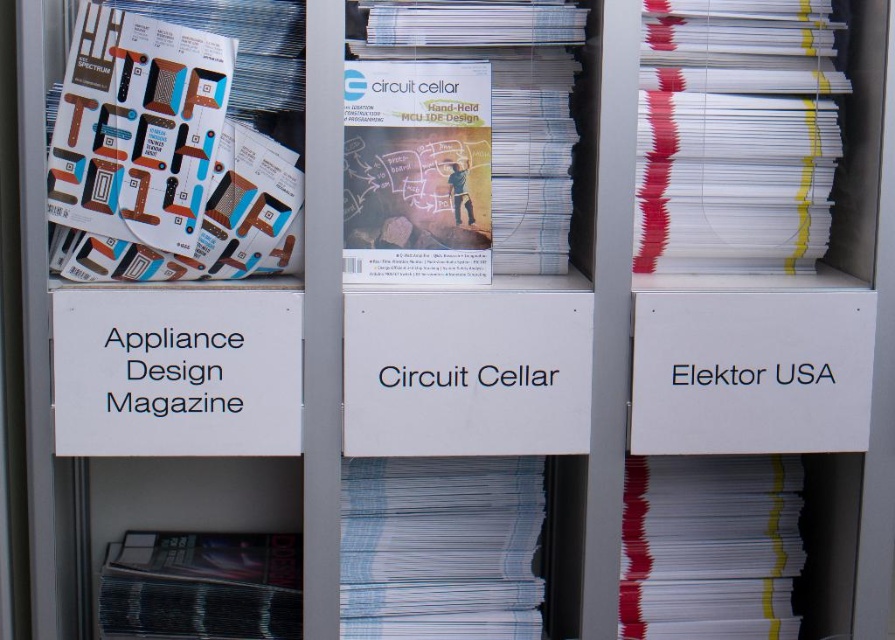
You are organizing a library and need to place a new book on the shelf. The shelf has limited vertical space. You have two items to place here, the white glossy magazine at center and the white paper stack at right. Which item should you choose to fit better in the limited vertical space?

The white paper stack at right has a smaller height compared to the white glossy magazine at center, so it would fit better in the limited vertical space.

You are standing in front of a magazine rack with two points marked on it. The first point is at coordinates point (280, 113) and the second is at point (444, 266). Which point is closer to you?

The point at point (280, 113) is closer to you because it is in front of point (444, 266).

What is the position of the white glossy magazine at center?

The white glossy magazine at center is located at point 0.220 on the x axis and 0.514 on the y axis.